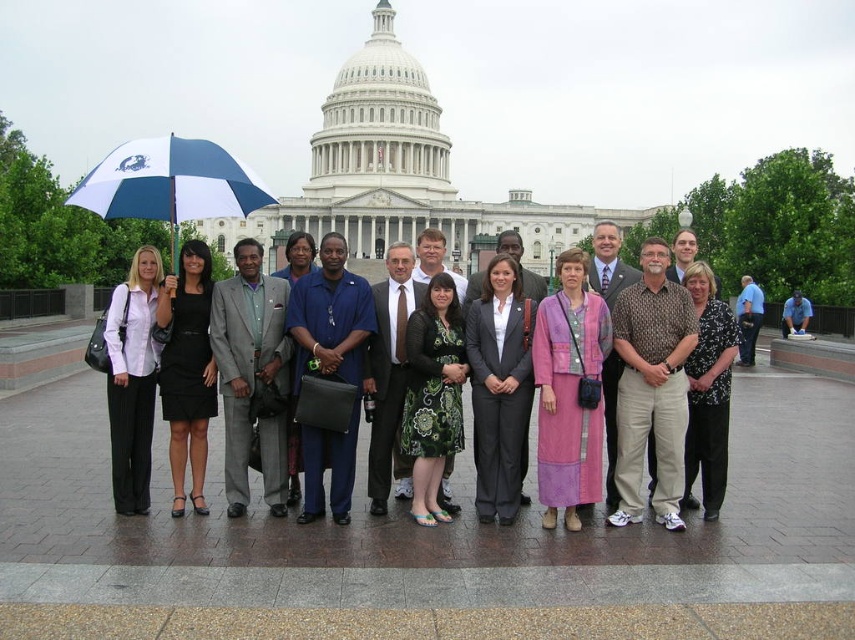
Does black fabric dress at center have a greater height compared to white pinstripe pants at left?

Yes.

Which is more to the right, black fabric dress at center or white pinstripe pants at left?

Positioned to the right is black fabric dress at center.

Is point (161, 288) in front of point (146, 349)?

No, (161, 288) is further to viewer.

Where is `black fabric dress at center`? The height and width of the screenshot is (640, 855). black fabric dress at center is located at coordinates (187, 371).

Between floral-patterned dress at center and black floral blouse at center, which one has more height?

black floral blouse at center

Measure the distance from floral-patterned dress at center to black floral blouse at center.

floral-patterned dress at center and black floral blouse at center are 65.25 feet apart from each other.

The height and width of the screenshot is (640, 855). Describe the element at coordinates (433, 396) in the screenshot. I see `floral-patterned dress at center` at that location.

The width and height of the screenshot is (855, 640). Identify the location of floral-patterned dress at center. (433, 396).

In the scene shown: Is blue and white fabric umbrella at center positioned before light blue shirt at center?

Yes, blue and white fabric umbrella at center is in front of light blue shirt at center.

Which is more to the right, blue and white fabric umbrella at center or light blue shirt at center?

Positioned to the right is light blue shirt at center.

Measure the distance between blue and white fabric umbrella at center and camera.

blue and white fabric umbrella at center and camera are 216.73 feet apart.

Locate an element on the screen. The width and height of the screenshot is (855, 640). blue and white fabric umbrella at center is located at coordinates (169, 184).